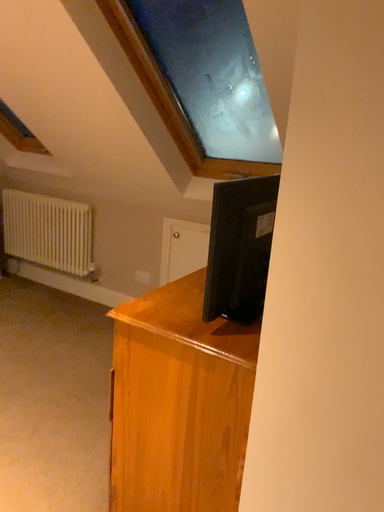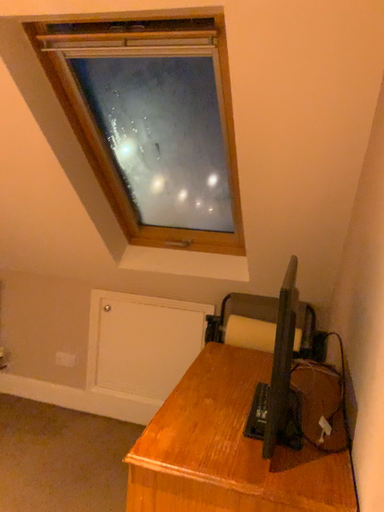
Question: Which way did the camera rotate in the video?

Choices:
 (A) rotated downward
 (B) rotated upward

Answer: (B)